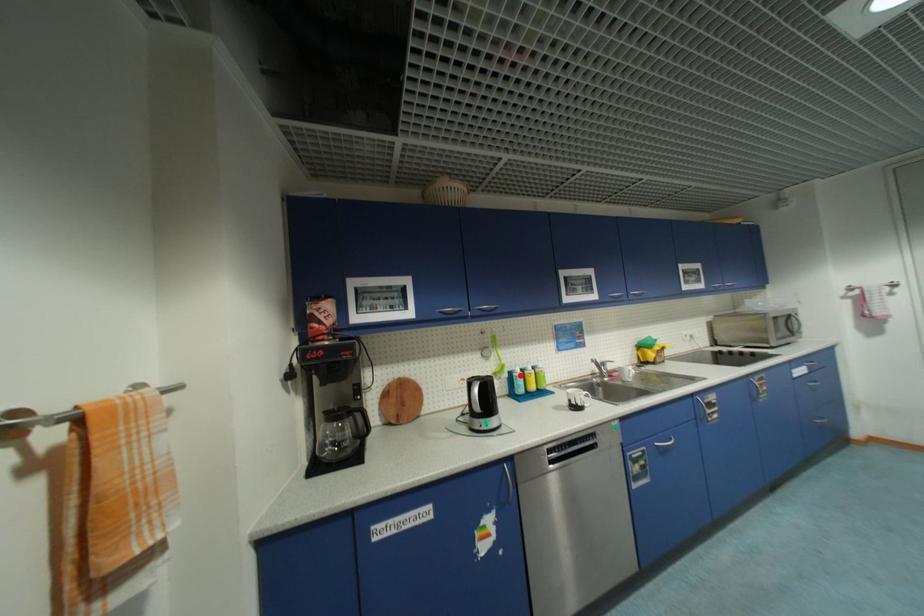
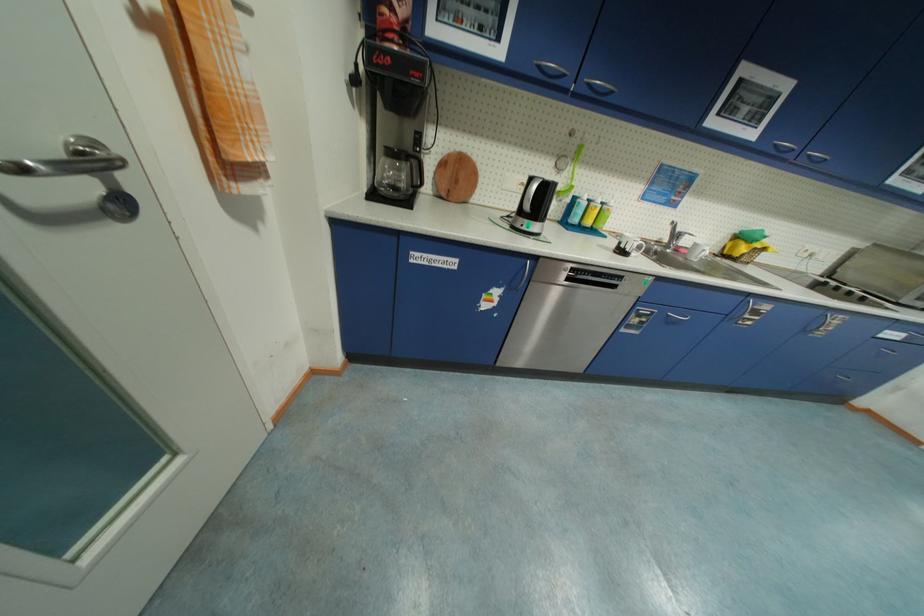
Locate, in the second image, the point that corresponds to the highlighted location in the first image.

(584, 201)